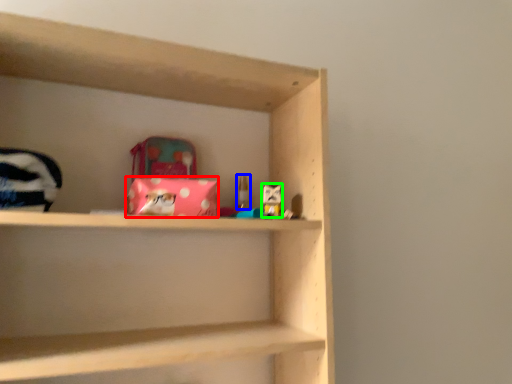
Question: Based on their relative distances, which object is nearer to material (highlighted by a red box)? Choose from toy (highlighted by a blue box) and toy (highlighted by a green box).

Choices:
 (A) toy
 (B) toy

Answer: (B)